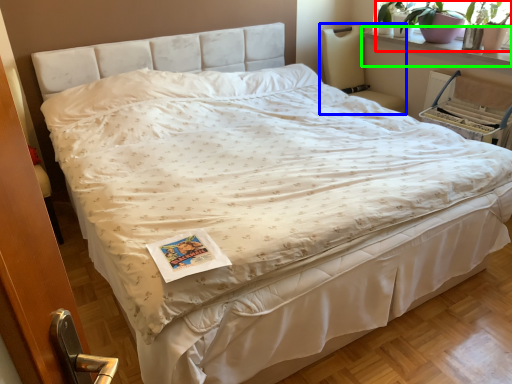
Question: Which object is the closest to the plant (highlighted by a red box)? Choose among these: rocking chair (highlighted by a blue box) or window sill (highlighted by a green box).

Choices:
 (A) rocking chair
 (B) window sill

Answer: (B)